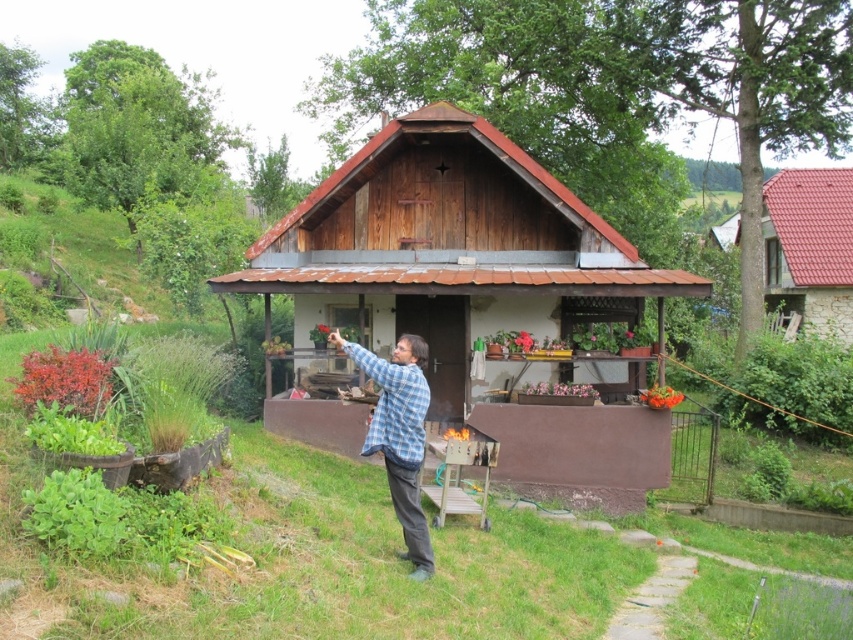
Question: Which object is the farthest from the red tile roof at upper right?

Choices:
 (A) blue plaid shirt at center
 (B) green grass at lower center
 (C) wooden cabin at center

Answer: (A)

Question: In this image, where is green grass at lower center located relative to blue plaid shirt at center?

Choices:
 (A) below
 (B) above

Answer: (A)

Question: Is wooden cabin at center above blue plaid shirt at center?

Choices:
 (A) no
 (B) yes

Answer: (B)

Question: Considering the relative positions of green grass at lower center and wooden cabin at center in the image provided, where is green grass at lower center located with respect to wooden cabin at center?

Choices:
 (A) right
 (B) left

Answer: (B)

Question: Which object is farther from the camera taking this photo?

Choices:
 (A) blue plaid shirt at center
 (B) green grass at lower center

Answer: (A)

Question: Which point is farther from the camera taking this photo?

Choices:
 (A) (575, 256)
 (B) (850, 314)
 (C) (412, 376)
 (D) (581, 637)

Answer: (B)